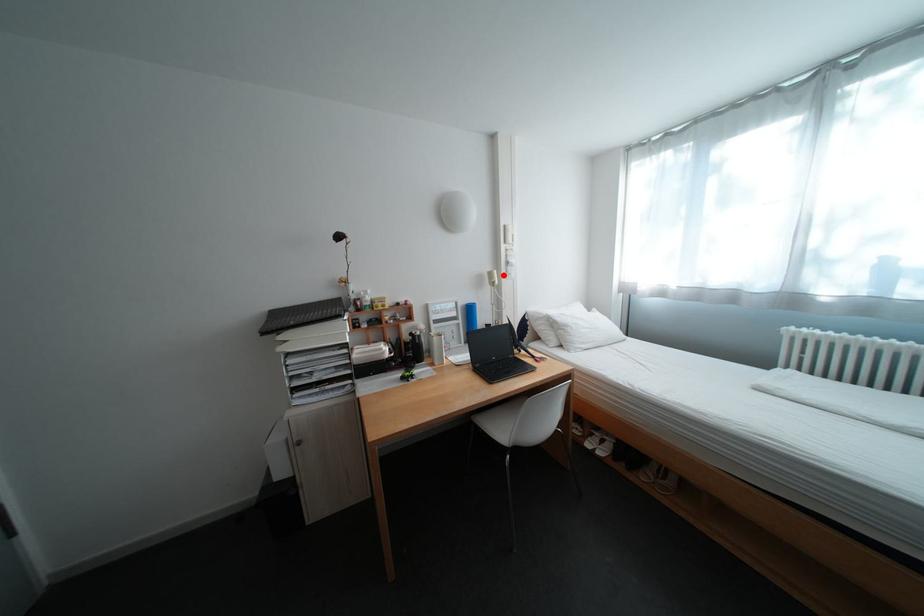
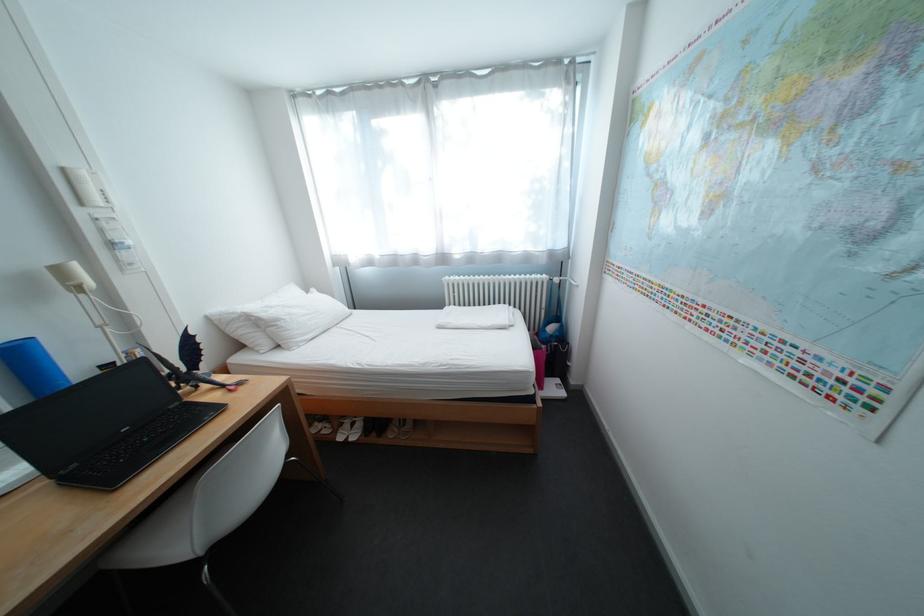
The point at the highlighted location is marked in the first image. Where is the corresponding point in the second image?

(71, 272)